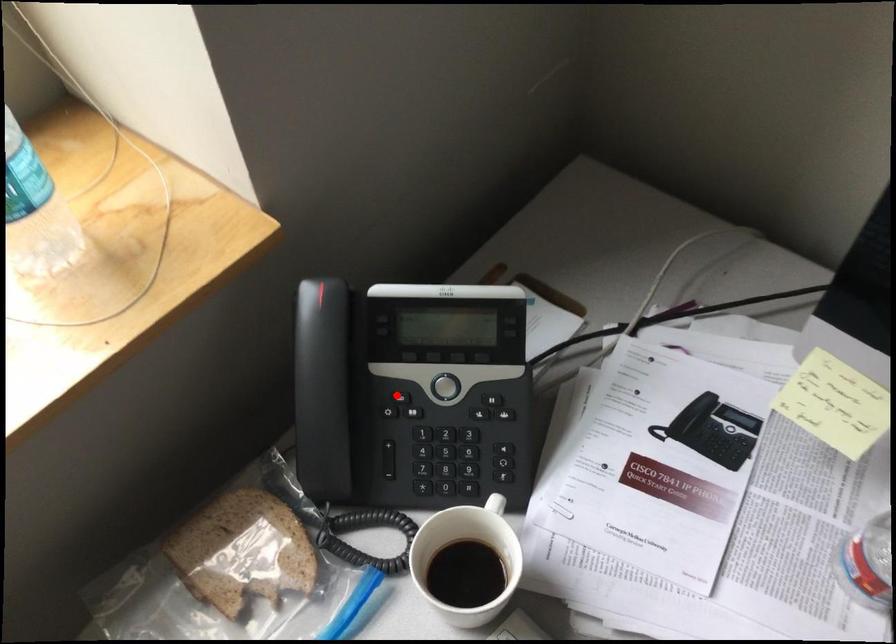
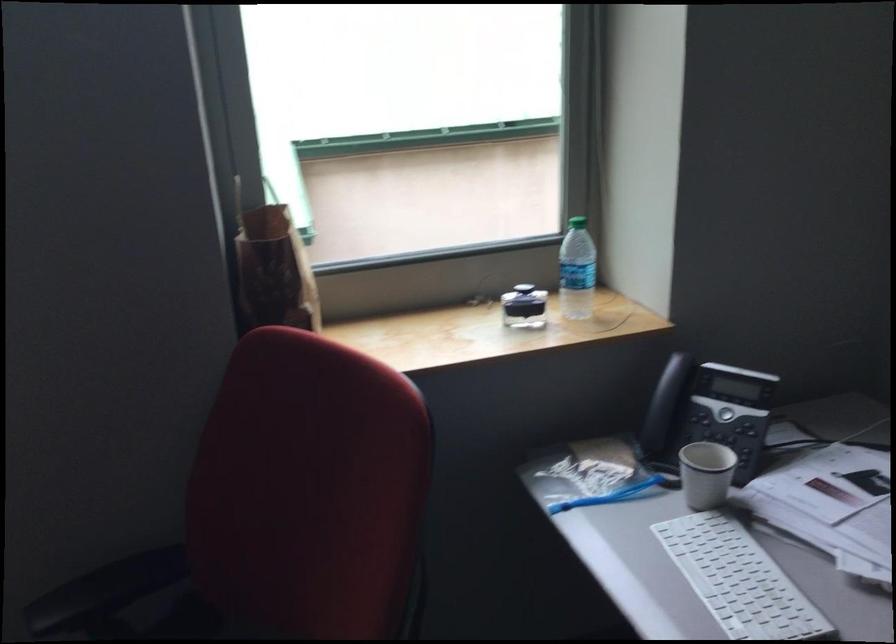
Question: I am providing you with two images of the same scene from different viewpoints. Given a red point in image1, look at the same physical point in image2. Is it:

Choices:
 (A) Closer to the viewpoint
 (B) Farther from the viewpoint

Answer: (B)